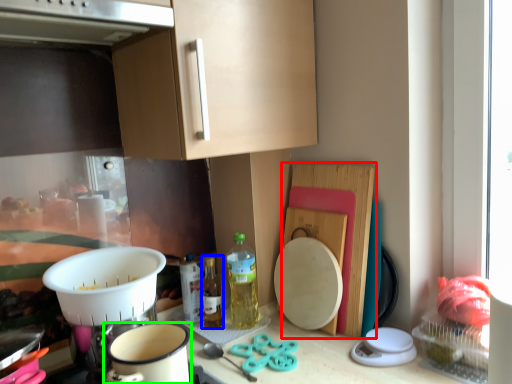
Question: Which object is the closest to the cutting board (highlighted by a red box)? Choose among these: bottle (highlighted by a blue box) or coffee cup (highlighted by a green box).

Choices:
 (A) bottle
 (B) coffee cup

Answer: (A)